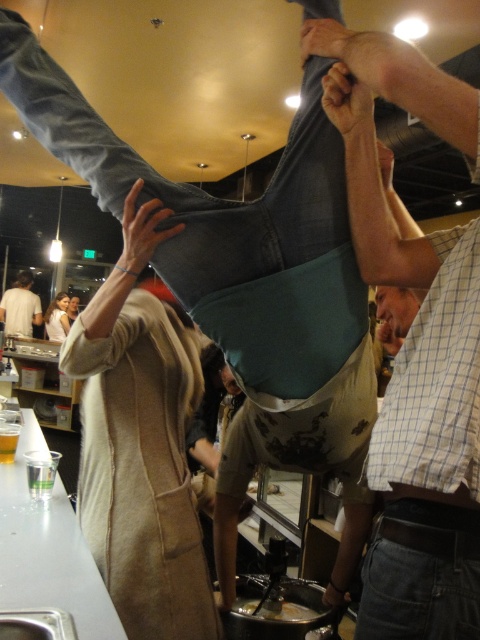
You are a photographer at the event and want to capture a photo that includes both the light beige fabric coat at center and the white cotton shirt at upper left. Which object should you focus on first to ensure both are in sharp focus?

You should focus on the light beige fabric coat at center first because it is closer to the viewer than the white cotton shirt at upper left, so adjusting focus from near to far will help both appear sharp.

You are a guest at the party and want to pick up the shiny silver spoon at lower center without disturbing the light beige fabric coat at center. Is the spoon accessible?

The light beige fabric coat at center is above the shiny silver spoon at lower center, so the spoon is accessible as it is below the coat and not obstructed by it.

You are a waiter carrying a tray of drinks. You need to walk from the shiny silver spoon at lower center to the denim jeans at center. Is the path between them clear enough for you to pass through without bumping into anything?

The distance between the denim jeans at center and the shiny silver spoon at lower center is 3.65 feet. Since this distance is sufficient for a person to walk through comfortably, the path is clear enough for you to pass without bumping into anything.